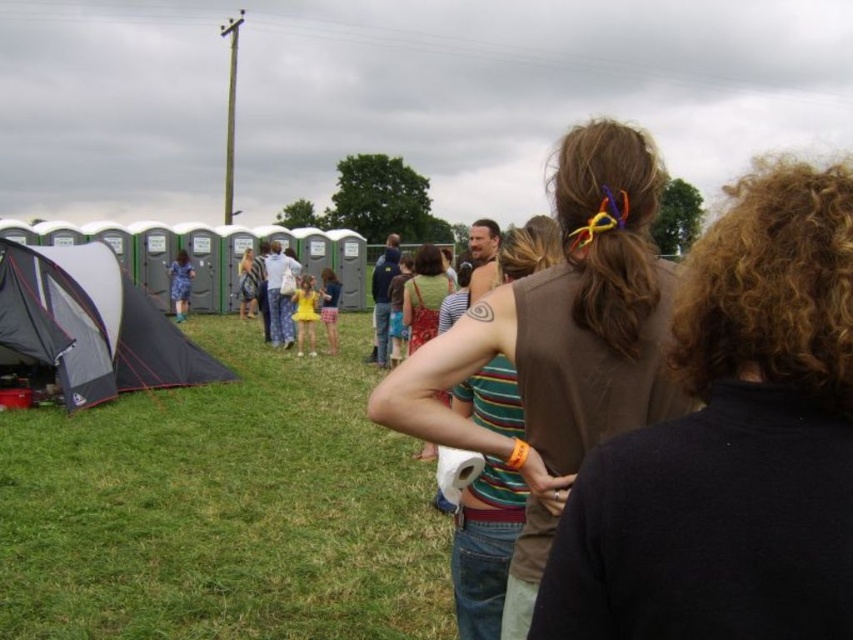
Is green grass at lower left shorter than brown fabric shirt at center?

Indeed, green grass at lower left has a lesser height compared to brown fabric shirt at center.

Describe the element at coordinates (222, 509) in the screenshot. I see `green grass at lower left` at that location.

Who is more distant from viewer, (328, 588) or (457, 371)?

Point (328, 588)

Where is `green grass at lower left`? Image resolution: width=853 pixels, height=640 pixels. green grass at lower left is located at coordinates (222, 509).

Can you confirm if green grass at lower left is shorter than brown hair at center?

In fact, green grass at lower left may be taller than brown hair at center.

Between green grass at lower left and brown hair at center, which one is positioned lower?

Positioned lower is green grass at lower left.

Does point (381, 524) lie behind point (596, 536)?

Yes, point (381, 524) is farther from viewer.

Locate an element on the screen. green grass at lower left is located at coordinates (222, 509).

Who is lower down, brown hair at center or brown fabric shirt at center?

brown hair at center

Is point (718, 252) positioned before point (438, 378)?

Yes, point (718, 252) is in front of point (438, 378).

The image size is (853, 640). I want to click on brown hair at center, so click(730, 442).